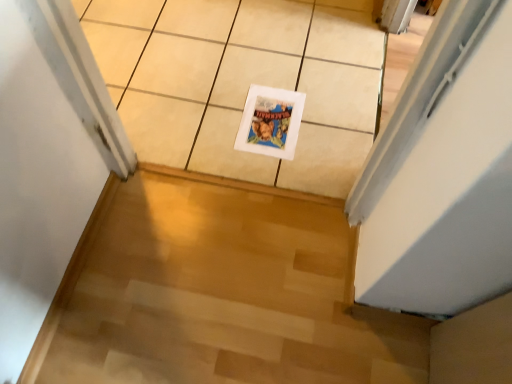
Describe the element at coordinates (218, 293) in the screenshot. The image size is (512, 384). I see `wooden at center` at that location.

Looking at this image, in order to face wooden at center, should I rotate leftwards or rightwards?

It's best to rotate left around 0.905 degrees.

Where is `wooden at center`? The height and width of the screenshot is (384, 512). wooden at center is located at coordinates (218, 293).

This screenshot has width=512, height=384. I want to click on wooden at center, so click(218, 293).